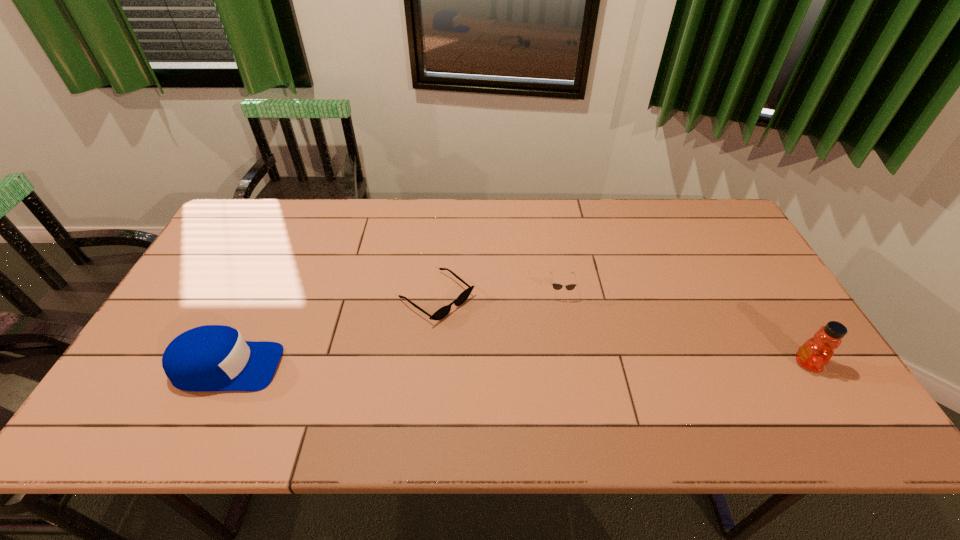
Identify the location of vacant space on the desktop that is between the leftmost object and the tallest object and is positioned in front of the lenses of the taller sunglasses. The height and width of the screenshot is (540, 960). (567, 365).

Identify the location of vacant space on the desktop that is between the baseball cap and the honey and is positioned on the front-facing side of the third object from right to left. (525, 365).